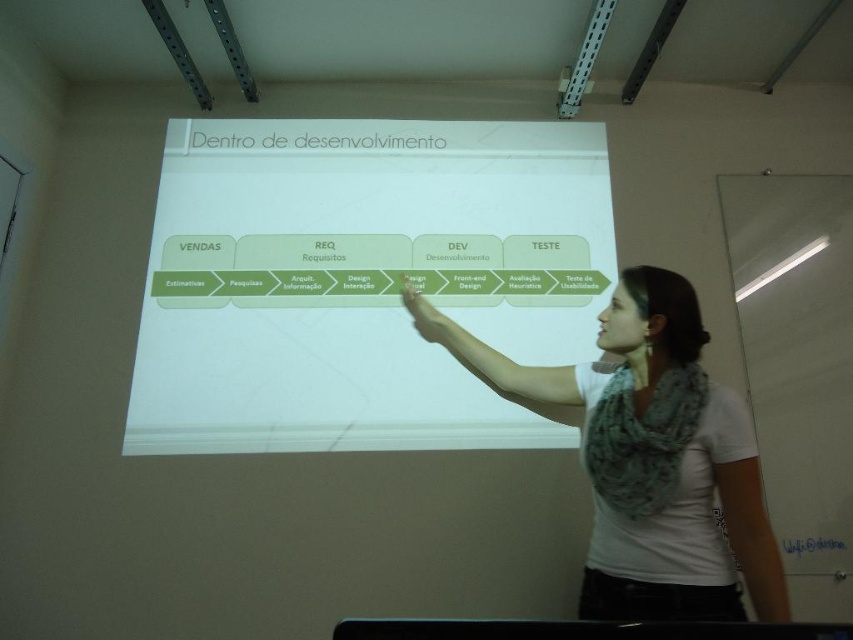
Between white matte projection screen at center and white fabric scarf at upper right, which one is positioned higher?

white matte projection screen at center

Does white matte projection screen at center appear on the right side of white fabric scarf at upper right?

Result: No, white matte projection screen at center is not to the right of white fabric scarf at upper right.

At what (x,y) coordinates should I click in order to perform the action: click on white matte projection screen at center. Please return your answer as a coordinate pair (x, y). Image resolution: width=853 pixels, height=640 pixels. Looking at the image, I should click on pyautogui.click(x=363, y=280).

At what (x,y) coordinates should I click in order to perform the action: click on white matte projection screen at center. Please return your answer as a coordinate pair (x, y). This screenshot has width=853, height=640. Looking at the image, I should click on (363, 280).